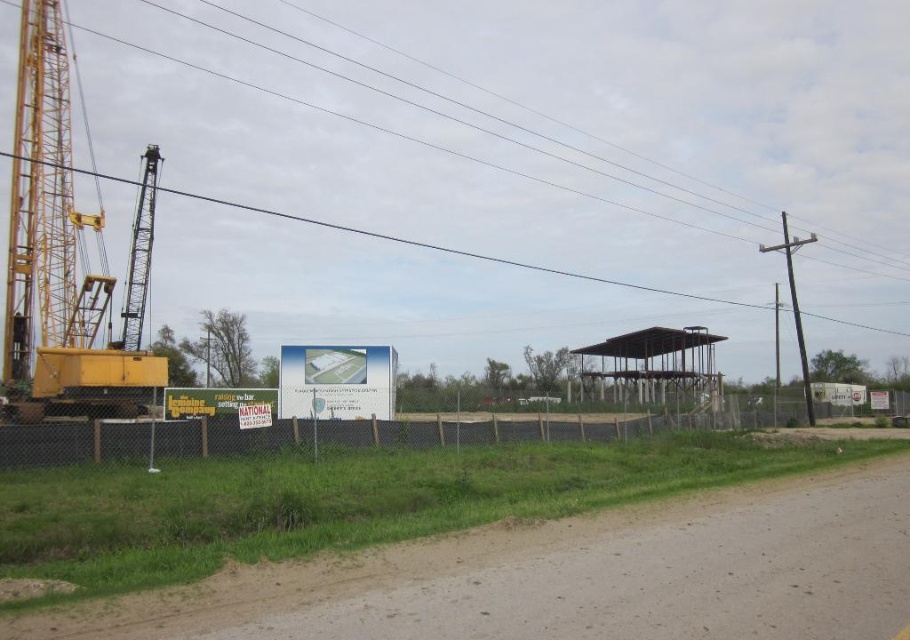
You are a delivery truck driver approaching the construction site. You see the white plastic sign at center. Can you estimate its location relative to the fence?

The white plastic sign at center is located at coordinates point [336,381], which is inside the construction site behind the fence.

You are a delivery driver approaching the construction site. You see the white plastic sign at center and the smooth gray pole at right. Which object is positioned lower in the scene?

The white plastic sign at center is located below the smooth gray pole at right, so it is positioned lower in the scene.

You are a delivery truck driver approaching the construction site. You need to drive over the brown gravel road at lower right and the metallic wire at upper center. Which path is wider for your truck to pass through safely?

The metallic wire at upper center is wider than the brown gravel road at lower right, so the truck should take the metallic wire at upper center for safer passage.